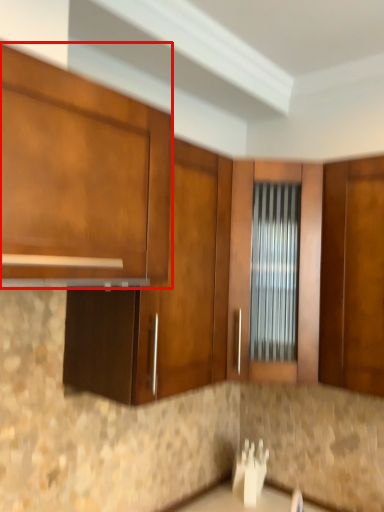
Question: From the image's perspective, where is cabinetry (annotated by the red box) located relative to cabinetry?

Choices:
 (A) above
 (B) below

Answer: (A)